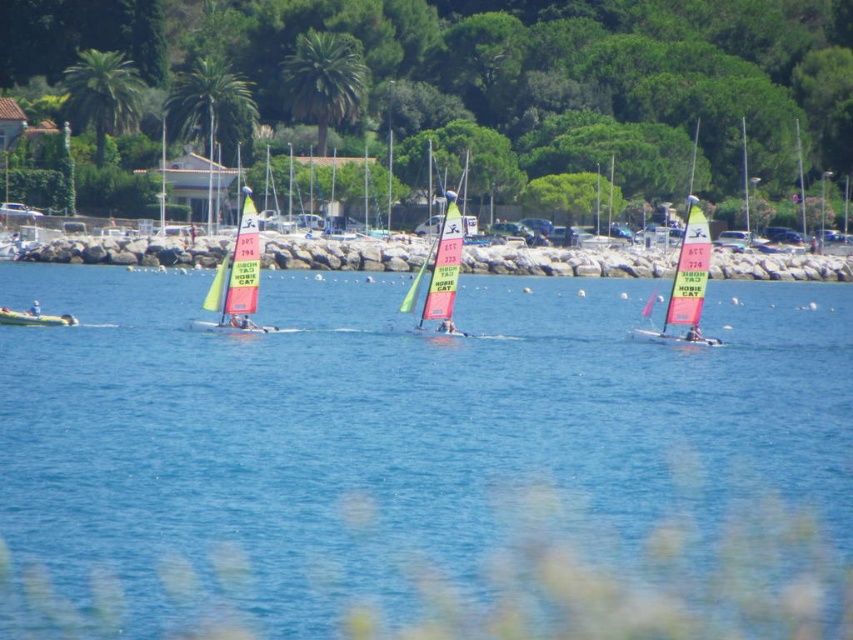
Question: Is blue water at center further to the viewer compared to white plastic kayak at left?

Choices:
 (A) yes
 (B) no

Answer: (B)

Question: From the image, what is the correct spatial relationship of yellow-green sailboat at center-left in relation to yellow-green fabric sailboat at center?

Choices:
 (A) below
 (B) above

Answer: (A)

Question: Among these objects, which one is farthest from the camera?

Choices:
 (A) white plastic kayak at left
 (B) blue water at center
 (C) pink fabric sailboat at right
 (D) yellow matte kayak at left

Answer: (A)

Question: Which object is farther from the camera taking this photo?

Choices:
 (A) pink fabric sailboat at right
 (B) blue water at center
 (C) yellow-green fabric sailboat at center
 (D) yellow-green sailboat at center-left

Answer: (A)

Question: Is pink fabric sailboat at right closer to camera compared to yellow matte kayak at left?

Choices:
 (A) yes
 (B) no

Answer: (A)

Question: Which of these objects is positioned farthest from the white plastic kayak at left?

Choices:
 (A) yellow matte kayak at left
 (B) blue water at center

Answer: (B)